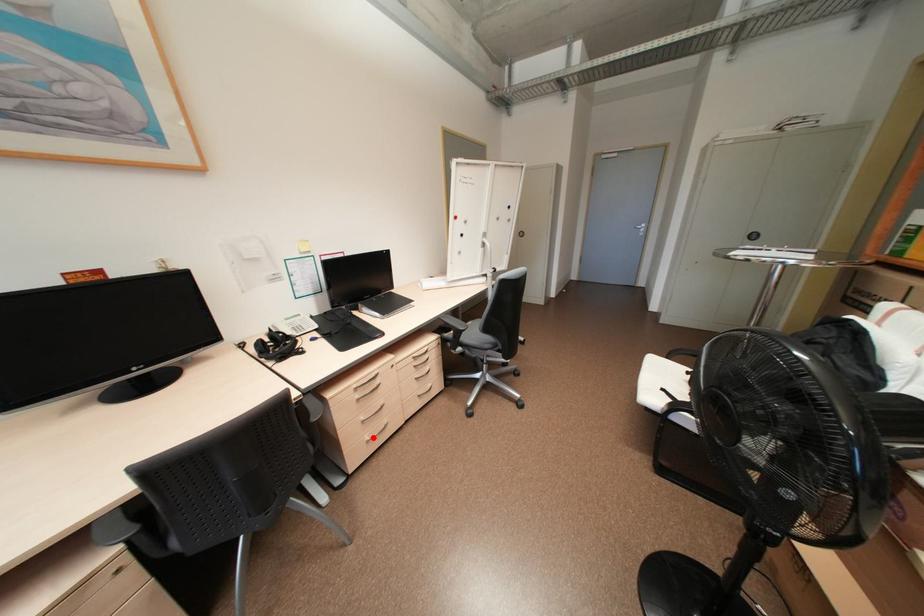
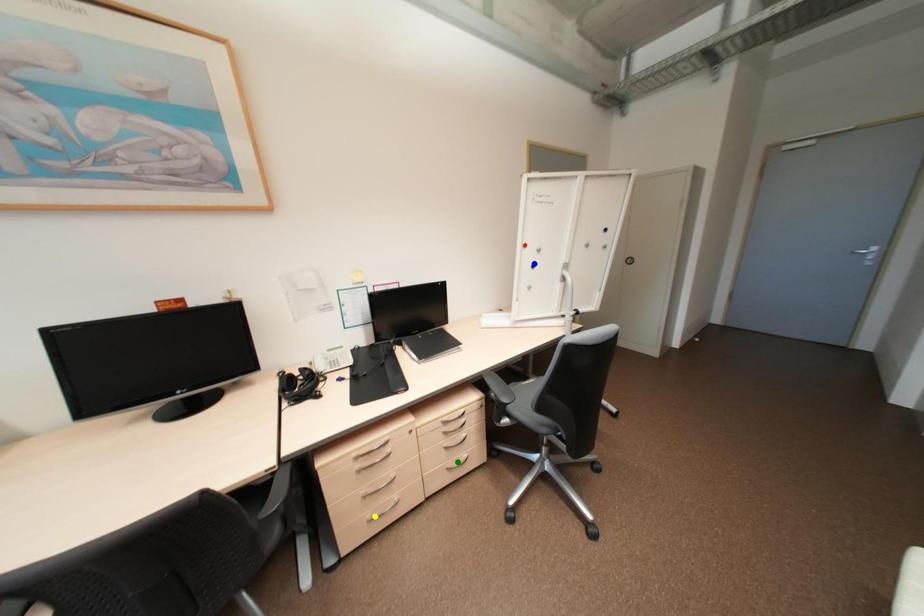
Question: I am providing you with two images of the same scene from different viewpoints. A red point is marked on the first image. You are given multiple points on the second image. Can you choose the point in image 2 that corresponds to the point in image 1?

Choices:
 (A) blue point
 (B) green point
 (C) yellow point

Answer: (C)